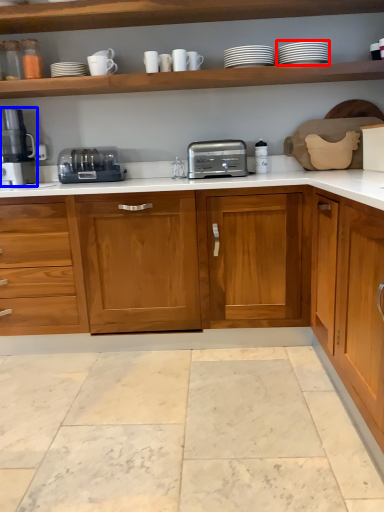
Question: Among these objects, which one is nearest to the camera, tableware (highlighted by a red box) or coffee machine (highlighted by a blue box)?

Choices:
 (A) tableware
 (B) coffee machine

Answer: (A)